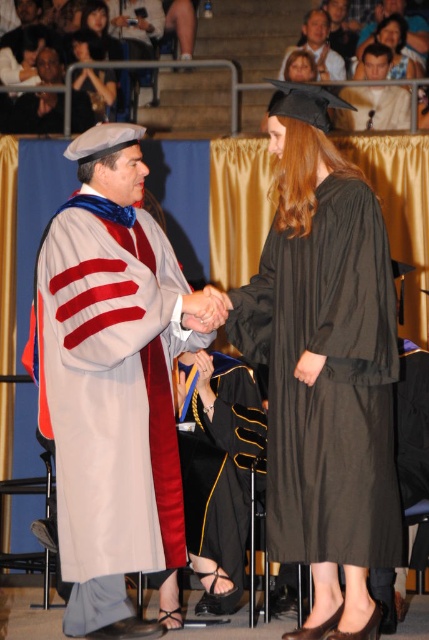
Can you confirm if light gray wool graduation gown at center is bigger than matte black gown at center?

Yes, light gray wool graduation gown at center is bigger than matte black gown at center.

Is point (135, 451) closer to viewer compared to point (393, 29)?

Yes, point (135, 451) is in front of point (393, 29).

Is point (57, 310) positioned after point (398, 54)?

No, (57, 310) is in front of (398, 54).

Locate an element on the screen. The image size is (429, 640). light gray wool graduation gown at center is located at coordinates (111, 380).

Is matte gray cap at upper left bigger than matte black gown at center?

No.

Is matte gray cap at upper left above matte black gown at center?

No, matte gray cap at upper left is not above matte black gown at center.

Is point (51, 81) in front of point (419, 67)?

No, (51, 81) is behind (419, 67).

Locate an element on the screen. The image size is (429, 640). matte gray cap at upper left is located at coordinates (38, 113).

Can you confirm if black matte gown at center is thinner than matte gray cap at upper left?

Yes, black matte gown at center is thinner than matte gray cap at upper left.

Is the position of black matte gown at center more distant than that of matte gray cap at upper left?

No, it is not.

Where is `black matte gown at center`? The width and height of the screenshot is (429, 640). black matte gown at center is located at coordinates (x=221, y=472).